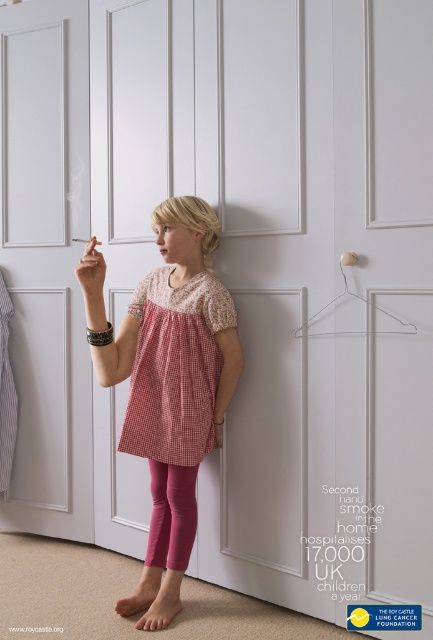
Question: Is pink smooth leggings at lower center smaller than matte plastic cigarette at upper center?

Choices:
 (A) no
 (B) yes

Answer: (B)

Question: Based on their relative distances, which object is nearer to the matte pink leggings at center?

Choices:
 (A) wire at upper right
 (B) white wood door at center
 (C) matte plastic cigarette at upper center
 (D) red gingham dress at center

Answer: (D)

Question: From the image, what is the correct spatial relationship of wire at upper right in relation to matte plastic cigarette at upper center?

Choices:
 (A) right
 (B) left

Answer: (A)

Question: Does white wood door at center have a lesser width compared to pink smooth leggings at lower center?

Choices:
 (A) yes
 (B) no

Answer: (B)

Question: Estimate the real-world distances between objects in this image. Which object is farther from the matte pink leggings at center?

Choices:
 (A) matte plastic cigarette at upper center
 (B) white wood door at center
 (C) pink smooth leggings at lower center
 (D) wire at upper right

Answer: (B)

Question: Which object is farther from the camera taking this photo?

Choices:
 (A) matte plastic cigarette at upper center
 (B) matte pink leggings at center
 (C) red gingham dress at center

Answer: (C)